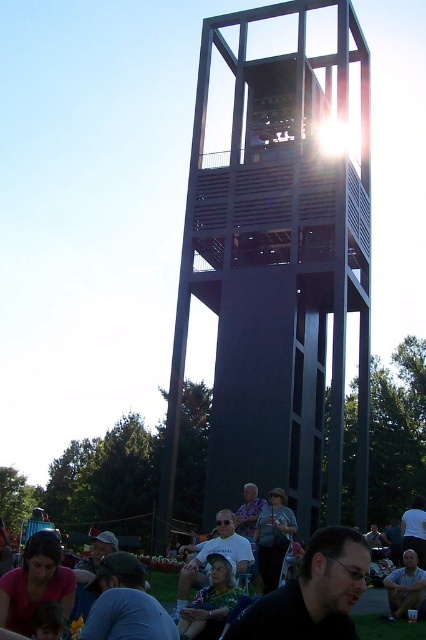
You are a photographer trying to capture a photo of the people in the park. You want to ensure both the matte gray shirt at center and the light brown leather jacket at lower right are visible in the frame. Based on their positions, which direction should you adjust your camera to include both subjects?

The matte gray shirt at center is to the left of the light brown leather jacket at lower right, so you should adjust your camera to the right to include both subjects in the frame.